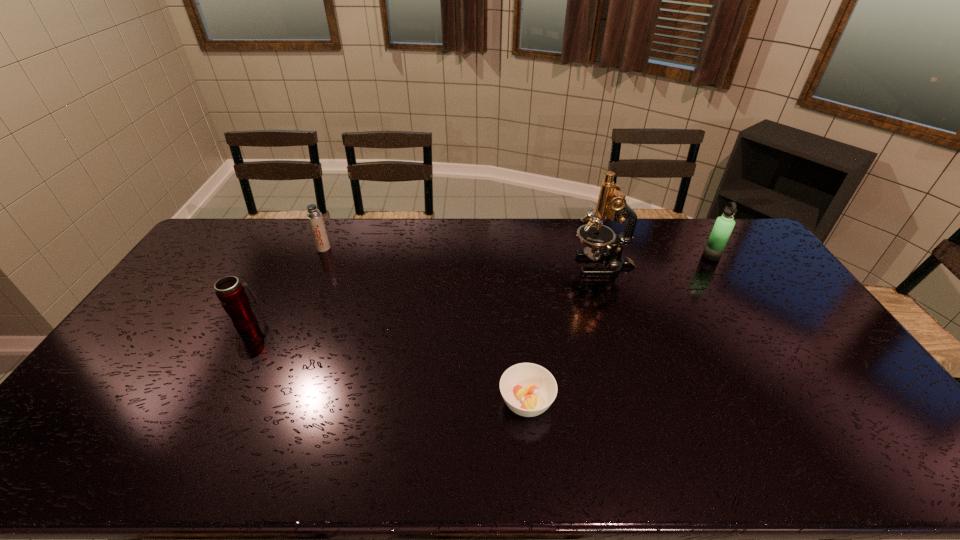
In order to click on microscope in this screenshot , I will do `click(611, 204)`.

The image size is (960, 540). In order to click on the second object from right to left in this screenshot , I will do `click(611, 204)`.

Where is `the rightmost thermos bottle`? The height and width of the screenshot is (540, 960). the rightmost thermos bottle is located at coordinates (722, 229).

You are a GUI agent. You are given a task and a screenshot of the screen. Output one action in this format:
    pyautogui.click(x=<x>, y=<y>)
    Task: Click on the second tallest object
    This screenshot has width=960, height=540.
    Given the screenshot: What is the action you would take?
    pyautogui.click(x=722, y=229)

This screenshot has width=960, height=540. What are the coordinates of `the second object from left to right` in the screenshot? It's located at (315, 220).

Identify the location of the leftmost thermos bottle. This screenshot has width=960, height=540. (229, 290).

Locate an element on the screen. the nearest thermos bottle is located at coordinates (229, 290).

What are the coordinates of `the shortest object` in the screenshot? It's located at (528, 389).

At what (x,y) coordinates should I click in order to perform the action: click on the nearest object. Please return your answer as a coordinate pair (x, y). The width and height of the screenshot is (960, 540). Looking at the image, I should click on (528, 389).

Locate an element on the screen. free space located 0.180m at the eyepiece of the tallest object is located at coordinates (520, 265).